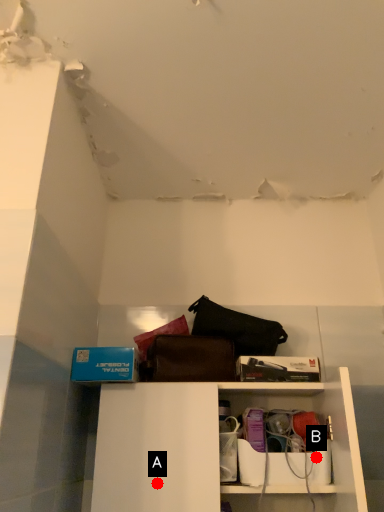
Question: Two points are circled on the image, labeled by A and B beside each circle. Among these points, which one is farthest from the camera?

Choices:
 (A) A is further
 (B) B is further

Answer: (B)